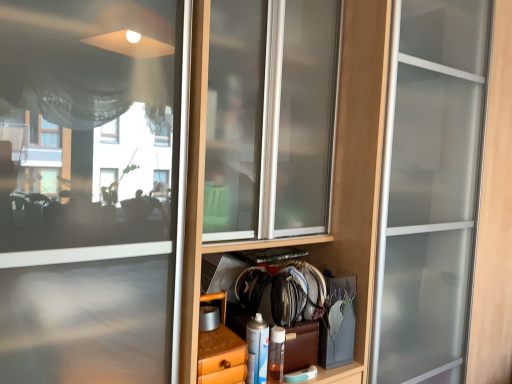
Question: Considering the relative positions of wooden drawer at lower center and translucent plastic spray can at lower center in the image provided, is wooden drawer at lower center to the left or to the right of translucent plastic spray can at lower center?

Choices:
 (A) right
 (B) left

Answer: (B)

Question: Relative to translucent plastic spray can at lower center, is wooden drawer at lower center in front or behind?

Choices:
 (A) front
 (B) behind

Answer: (A)

Question: From their relative heights in the image, would you say wooden drawer at lower center is taller or shorter than translucent plastic spray can at lower center?

Choices:
 (A) tall
 (B) short

Answer: (A)

Question: From a real-world perspective, is translucent plastic spray can at lower center positioned above or below wooden drawer at lower center?

Choices:
 (A) below
 (B) above

Answer: (A)

Question: Is translucent plastic spray can at lower center to the left or to the right of wooden drawer at lower center in the image?

Choices:
 (A) left
 (B) right

Answer: (B)

Question: Is point (251, 322) positioned closer to the camera than point (239, 354)?

Choices:
 (A) farther
 (B) closer

Answer: (A)

Question: Is translucent plastic spray can at lower center taller or shorter than wooden drawer at lower center?

Choices:
 (A) tall
 (B) short

Answer: (B)